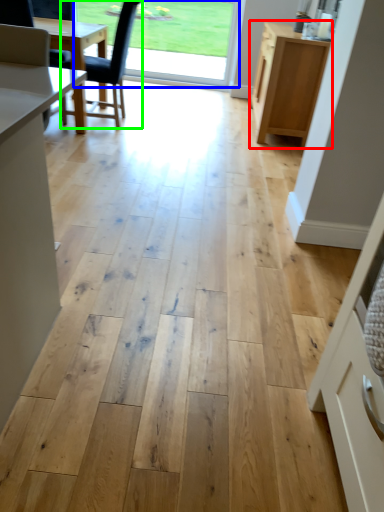
Question: Estimate the real-world distances between objects in this image. Which object is closer to cabinetry (highlighted by a red box), window screen (highlighted by a blue box) or chair (highlighted by a green box)?

Choices:
 (A) window screen
 (B) chair

Answer: (B)